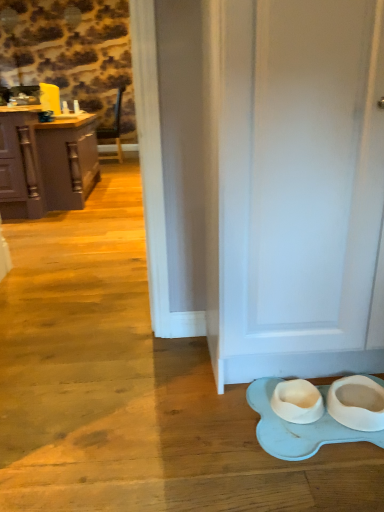
Question: Is white matte door at lower right aimed at matte gray cabinets at left?

Choices:
 (A) yes
 (B) no

Answer: (B)

Question: Considering the relative sizes of white matte door at lower right and matte gray cabinets at left in the image provided, is white matte door at lower right bigger than matte gray cabinets at left?

Choices:
 (A) no
 (B) yes

Answer: (A)

Question: Is white matte door at lower right positioned with its back to matte gray cabinets at left?

Choices:
 (A) no
 (B) yes

Answer: (A)

Question: From the image's perspective, is white matte door at lower right on matte gray cabinets at left?

Choices:
 (A) no
 (B) yes

Answer: (A)

Question: From a real-world perspective, is white matte door at lower right positioned under matte gray cabinets at left based on gravity?

Choices:
 (A) yes
 (B) no

Answer: (B)

Question: Can you confirm if white matte door at lower right is shorter than matte gray cabinets at left?

Choices:
 (A) yes
 (B) no

Answer: (B)

Question: Considering the relative positions of matte gray cabinets at left and white matte door at lower right in the image provided, is matte gray cabinets at left behind white matte door at lower right?

Choices:
 (A) no
 (B) yes

Answer: (B)

Question: Does matte gray cabinets at left have a larger size compared to white matte door at lower right?

Choices:
 (A) yes
 (B) no

Answer: (A)

Question: Is matte gray cabinets at left next to white matte door at lower right?

Choices:
 (A) no
 (B) yes

Answer: (A)

Question: From a real-world perspective, does matte gray cabinets at left stand above white matte door at lower right?

Choices:
 (A) no
 (B) yes

Answer: (A)

Question: Does matte gray cabinets at left have a smaller size compared to white matte door at lower right?

Choices:
 (A) yes
 (B) no

Answer: (B)

Question: From a real-world perspective, is matte gray cabinets at left located beneath white matte door at lower right?

Choices:
 (A) no
 (B) yes

Answer: (B)

Question: Based on their sizes in the image, would you say white matte door at lower right is bigger or smaller than matte gray cabinets at left?

Choices:
 (A) big
 (B) small

Answer: (B)